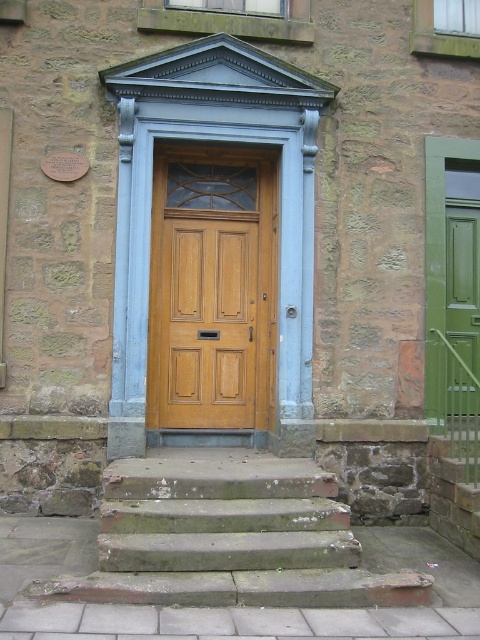
You are standing at the base of the green stone stairs at center and want to enter the wooden door at center. Which direction should you move to reach the door?

The green stone stairs at center is in front of the wooden door at center, so you should move forward towards the wooden door at center to reach it.

You are standing at the entrance of the building and want to go to the garden located to the right of the wooden door at center. Which direction should you move relative to the green stone stairs at center?

You should move to the right of the green stone stairs at center because the wooden door at center is to the left of the green stone stairs at center, so the garden to the right of the wooden door at center would be further to the right beyond the stairs.